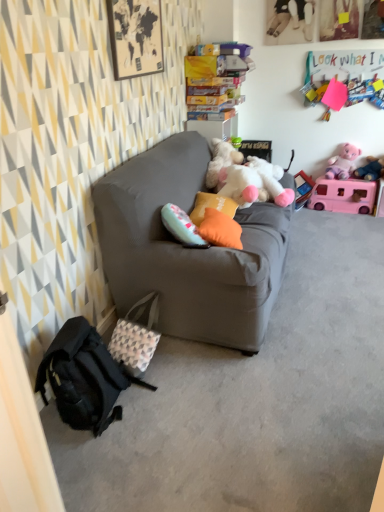
Question: Choose the correct answer: Is matte gray couch at center inside pink plush toy at upper right, positioned as the 2th toy in top-to-bottom order, or outside it?

Choices:
 (A) inside
 (B) outside

Answer: (B)

Question: Considering the relative positions of matte gray couch at center and pink plush toy at upper right, positioned as the 2th toy in top-to-bottom order, in the image provided, is matte gray couch at center to the left or to the right of pink plush toy at upper right, positioned as the 2th toy in top-to-bottom order,?

Choices:
 (A) right
 (B) left

Answer: (B)

Question: Which of these objects is positioned closest to the pink plush toy at upper right, the third toy in the bottom-to-top sequence?

Choices:
 (A) patterned fabric bag at lower left
 (B) matte gray couch at center
 (C) white plush toy at center, marked as the 5th toy in a top-to-bottom arrangement
 (D) black fabric backpack at lower left
 (E) pink plush toy at upper right, positioned as the 2th toy in top-to-bottom order

Answer: (E)

Question: Which of these objects is positioned farthest from the pink felt sign at upper right, the first toy in the top-to-bottom sequence?

Choices:
 (A) pink plush toy at upper right, the third toy in the bottom-to-top sequence
 (B) black fabric backpack at lower left
 (C) pink plastic toy at upper right, the 2th toy ordered from the bottom
 (D) patterned fabric bag at lower left
 (E) matte gray couch at center

Answer: (B)